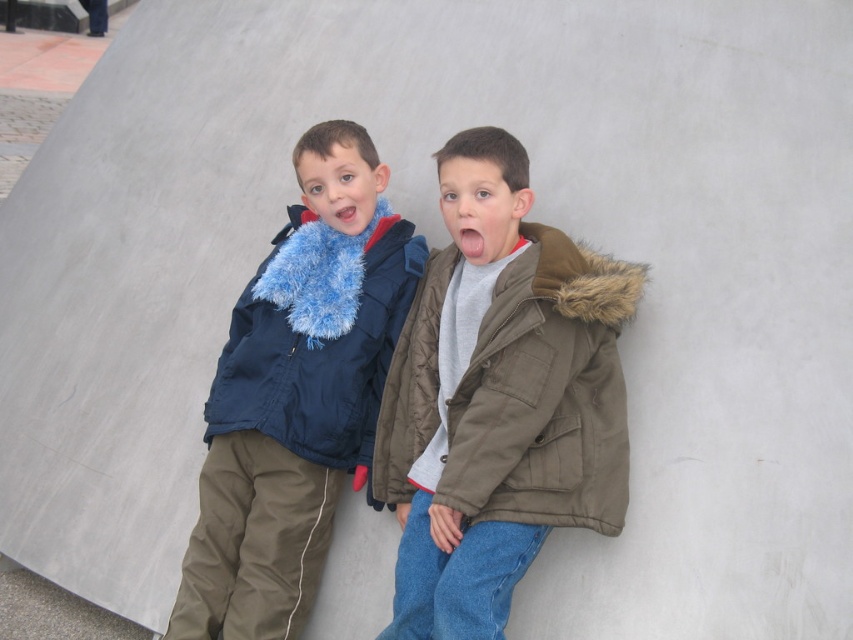
Please look at the two boys in the image. The first boy is the one wearing a dark blue jacket with a fluffy blue fur lined hood, khaki pants, and red gloves. The second boy is wearing a brown jacket with a fur lined hood, a gray shirt, and blue jeans. Now, there is a point at coordinates [297,394]. Which boy is the matte blue scarf at left closer to?

The point [297,394] indicates the matte blue scarf at left, which is closer to the first boy wearing the dark blue jacket with a fluffy blue fur lined hood, khaki pants, and red gloves.

You are a photographer trying to capture the two boys in the scene. You notice the matte blue scarf at left and the matte blue fur at left. Which one is higher up in the image?

The matte blue scarf at left is taller than the matte blue fur at left, so the scarf is higher up in the image.

Based on the photo, you are a photographer who wants to capture the olive green quilted jacket at center in the image. Based on its coordinates, where should you focus your camera?

The olive green quilted jacket at center is located at coordinates point [544,392], so you should focus your camera there.